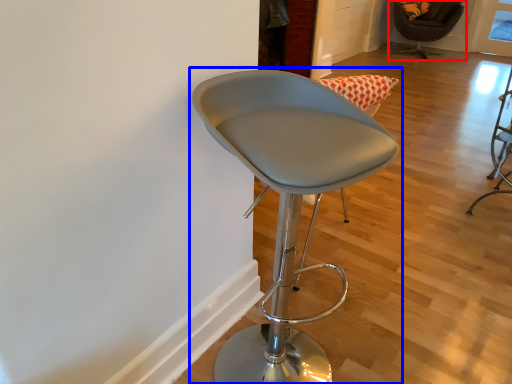
Question: Which object appears farthest to the camera in this image, chair (highlighted by a red box) or chair (highlighted by a blue box)?

Choices:
 (A) chair
 (B) chair

Answer: (A)